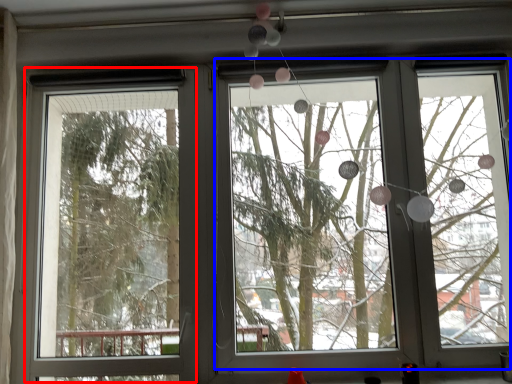
Question: Which object appears farthest to the camera in this image, screen door (highlighted by a red box) or bay window (highlighted by a blue box)?

Choices:
 (A) screen door
 (B) bay window

Answer: (A)